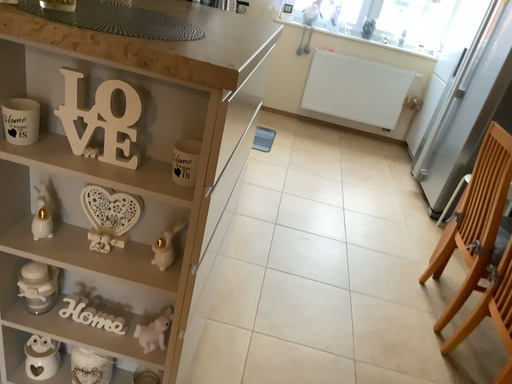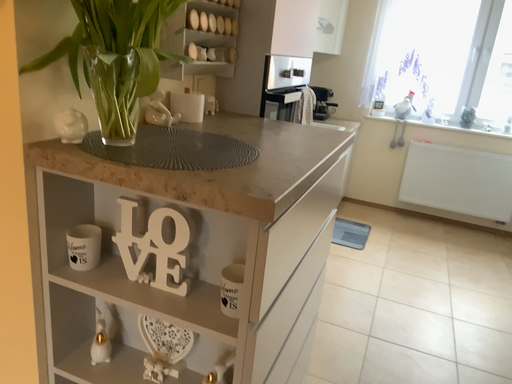
Question: Which way did the camera rotate in the video?

Choices:
 (A) rotated left
 (B) rotated right

Answer: (A)